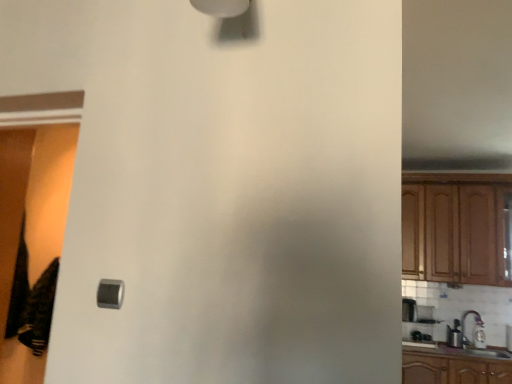
Question: From a real-world perspective, is black cotton laundry at lower left under satin silver switch at lower left?

Choices:
 (A) yes
 (B) no

Answer: (A)

Question: Is black cotton laundry at lower left to the right of satin silver switch at lower left from the viewer's perspective?

Choices:
 (A) yes
 (B) no

Answer: (B)

Question: Does black cotton laundry at lower left turn towards satin silver switch at lower left?

Choices:
 (A) no
 (B) yes

Answer: (A)

Question: Does black cotton laundry at lower left have a greater height compared to satin silver switch at lower left?

Choices:
 (A) yes
 (B) no

Answer: (A)

Question: Is black cotton laundry at lower left positioned beyond the bounds of satin silver switch at lower left?

Choices:
 (A) no
 (B) yes

Answer: (B)

Question: Would you say satin silver switch at lower left is inside or outside wooden cabinet at right?

Choices:
 (A) outside
 (B) inside

Answer: (A)

Question: In terms of size, does satin silver switch at lower left appear bigger or smaller than wooden cabinet at right?

Choices:
 (A) big
 (B) small

Answer: (B)

Question: Would you say satin silver switch at lower left is to the left or to the right of wooden cabinet at right in the picture?

Choices:
 (A) right
 (B) left

Answer: (B)

Question: From a real-world perspective, is satin silver switch at lower left physically located above or below wooden cabinet at right?

Choices:
 (A) above
 (B) below

Answer: (B)

Question: From a real-world perspective, is wooden cabinet at right physically located above or below metallic silver toaster at right?

Choices:
 (A) above
 (B) below

Answer: (A)

Question: In the image, is wooden cabinet at right on the left side or the right side of metallic silver toaster at right?

Choices:
 (A) right
 (B) left

Answer: (A)

Question: Is wooden cabinet at right inside the boundaries of metallic silver toaster at right, or outside?

Choices:
 (A) inside
 (B) outside

Answer: (B)

Question: Is wooden cabinet at right taller or shorter than metallic silver toaster at right?

Choices:
 (A) tall
 (B) short

Answer: (A)

Question: From a real-world perspective, relative to satin silver switch at lower left, is wooden cabinet at right vertically above or below?

Choices:
 (A) below
 (B) above

Answer: (B)

Question: From the image's perspective, is wooden cabinet at right positioned above or below satin silver switch at lower left?

Choices:
 (A) above
 (B) below

Answer: (B)